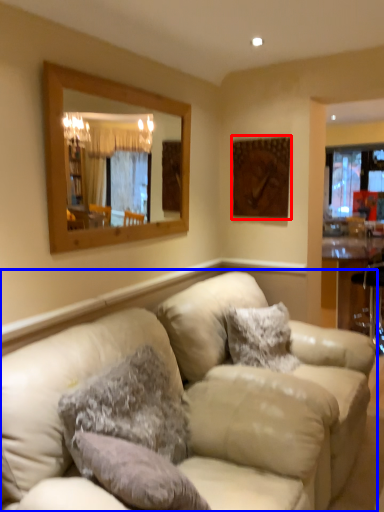
Question: Which point is further to the camera, picture frame (highlighted by a red box) or studio couch (highlighted by a blue box)?

Choices:
 (A) picture frame
 (B) studio couch

Answer: (A)